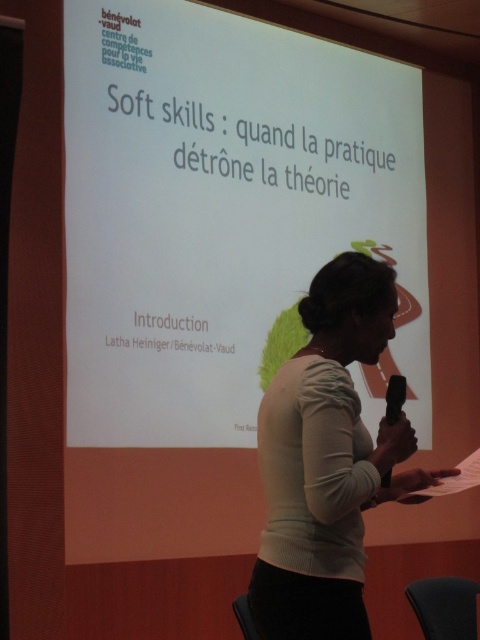
Question: Can you confirm if white matte projection screen at upper center is thinner than matte white sweater at center?

Choices:
 (A) no
 (B) yes

Answer: (A)

Question: Which point is closer to the camera?

Choices:
 (A) (348, 356)
 (B) (313, 131)

Answer: (A)

Question: Is white matte projection screen at upper center bigger than matte white sweater at center?

Choices:
 (A) no
 (B) yes

Answer: (B)

Question: Which point is closer to the camera taking this photo?

Choices:
 (A) (181, 1)
 (B) (357, 588)

Answer: (B)

Question: Can you confirm if white matte projection screen at upper center is positioned below matte white sweater at center?

Choices:
 (A) no
 (B) yes

Answer: (A)